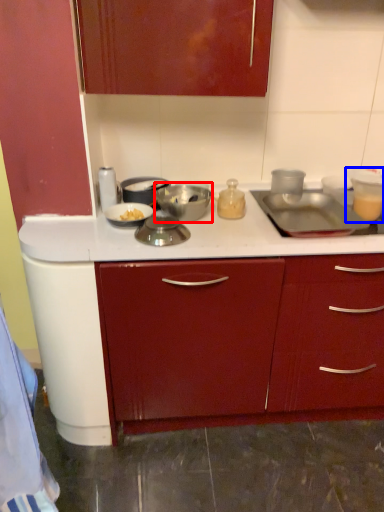
Question: Which of the following is the closest to the observer, kitchen appliance (highlighted by a red box) or appliance (highlighted by a blue box)?

Choices:
 (A) kitchen appliance
 (B) appliance

Answer: (A)